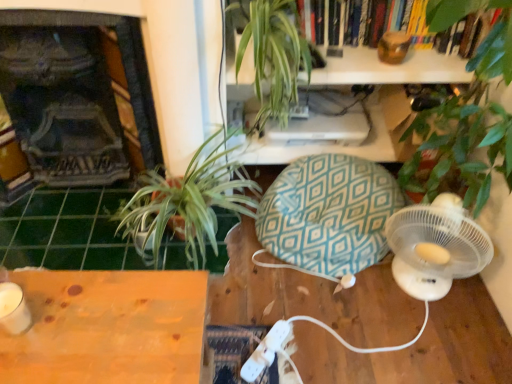
Question: Is point (41, 69) positioned closer to the camera than point (275, 57)?

Choices:
 (A) closer
 (B) farther

Answer: (B)

Question: Is dark gray stone fireplace at left wider or thinner than green leafy plant at upper center?

Choices:
 (A) wide
 (B) thin

Answer: (B)

Question: Based on their relative distances, which object is farther from the white plastic fan at lower right?

Choices:
 (A) green tile at lower left
 (B) dark gray stone fireplace at left
 (C) wooden table at lower left
 (D) green leafy plant at upper center
 (E) teal diamond-patterned bean bag chair at center

Answer: (B)

Question: Which of these objects is positioned farthest from the green leafy plant at upper center?

Choices:
 (A) white plastic fan at lower right
 (B) wooden table at lower left
 (C) teal diamond-patterned bean bag chair at center
 (D) green leafy plant at left
 (E) white plastic wii controller at lower center

Answer: (E)